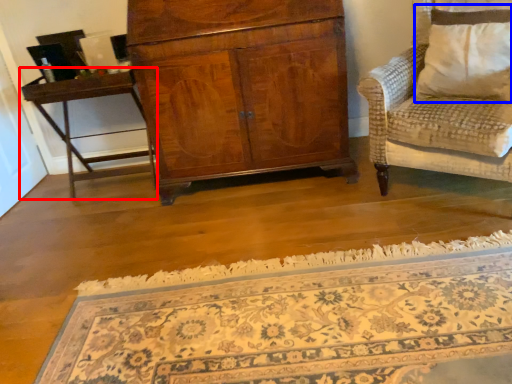
Question: Which of the following is the closest to the observer, table (highlighted by a red box) or pillow (highlighted by a blue box)?

Choices:
 (A) table
 (B) pillow

Answer: (B)